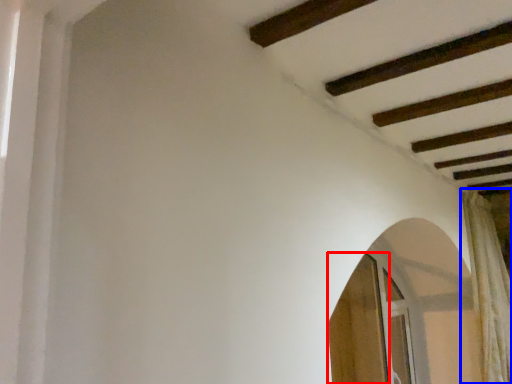
Question: Which object is further to the camera taking this photo, screen door (highlighted by a red box) or curtain (highlighted by a blue box)?

Choices:
 (A) screen door
 (B) curtain

Answer: (B)